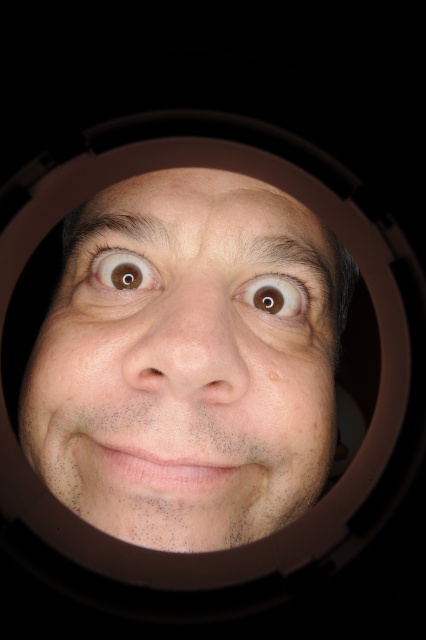
Does brown matte eye at center lie in front of brown matte eye at upper left?

No.

Can you confirm if brown matte eye at center is taller than brown matte eye at upper left?

Indeed, brown matte eye at center has a greater height compared to brown matte eye at upper left.

Describe the element at coordinates (273, 296) in the screenshot. I see `brown matte eye at center` at that location.

Image resolution: width=426 pixels, height=640 pixels. I want to click on brown matte eye at center, so click(x=273, y=296).

Measure the distance from smooth skin face at center to brown matte eye at upper left.

smooth skin face at center and brown matte eye at upper left are 3.15 inches apart from each other.

Which is in front, point (261, 419) or point (155, 275)?

Positioned in front is point (261, 419).

Locate an element on the screen. This screenshot has width=426, height=640. smooth skin face at center is located at coordinates (187, 364).

Locate an element on the screen. smooth skin face at center is located at coordinates (187, 364).

Can you confirm if smooth skin face at center is bigger than brown matte eye at center?

Correct, smooth skin face at center is larger in size than brown matte eye at center.

Who is positioned more to the left, smooth skin face at center or brown matte eye at center?

Positioned to the left is smooth skin face at center.

Who is more distant from viewer, (290,224) or (284,310)?

Positioned behind is point (284,310).

The width and height of the screenshot is (426, 640). I want to click on smooth skin face at center, so pos(187,364).